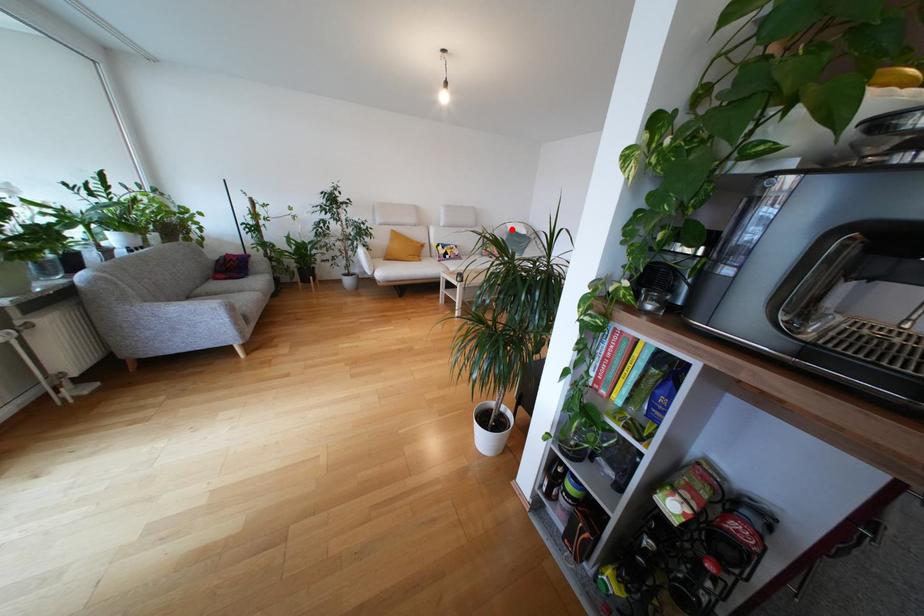
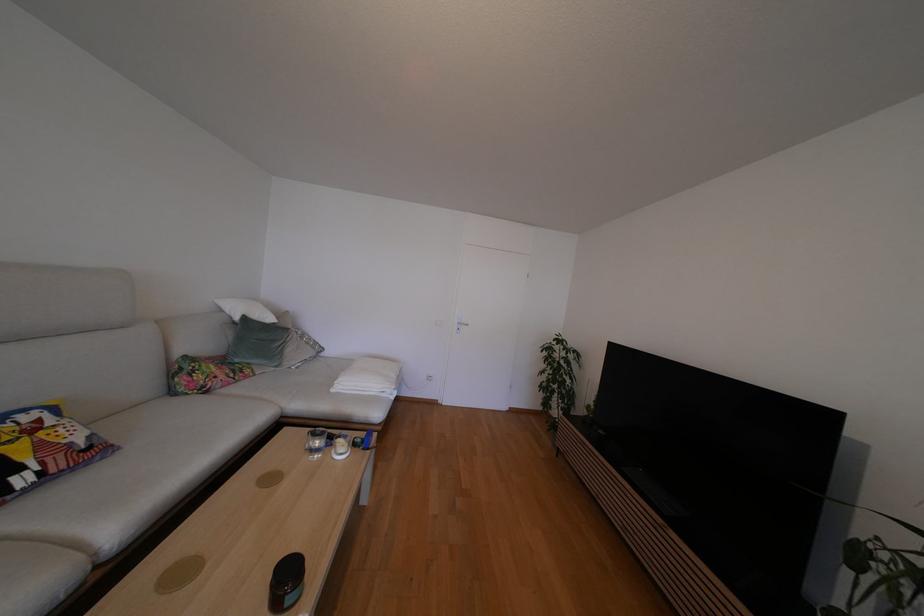
Find the pixel in the second image that matches the highlighted location in the first image.

(227, 314)